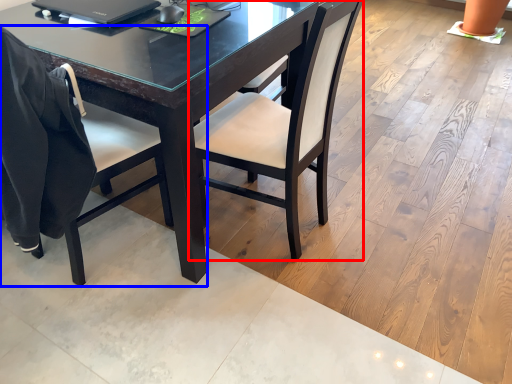
Question: Which of the following is the farthest to the observer, chair (highlighted by a red box) or chair (highlighted by a blue box)?

Choices:
 (A) chair
 (B) chair

Answer: (A)